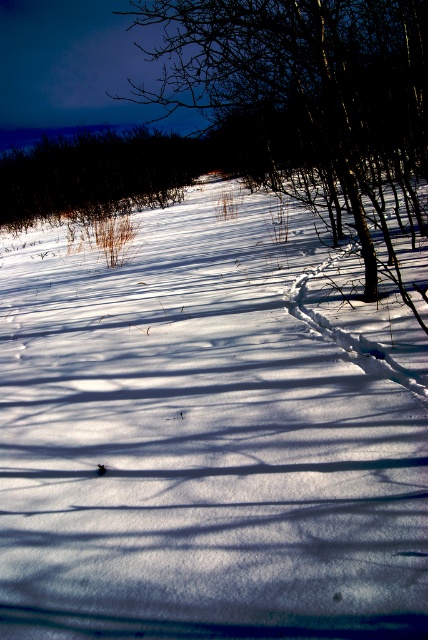
You are an observer looking at the winter scene. You notice the white snow at center and the dark brown shrub at upper left. Which object is positioned higher in the image?

The dark brown shrub at upper left is positioned higher in the image than the white snow at center.

You are an animal tracker observing the winter landscape. You see the white snow at center and the brown textured tree at center. How far apart are these two landmarks?

The white snow at center is 12.34 feet from the brown textured tree at center.

You are an artist sketching the winter scene. You want to draw the brown textured tree at center and the dark brown shrub at upper left. Which one should you draw first if you follow the rule of starting with larger objects?

The brown textured tree at center is bigger than the dark brown shrub at upper left, so you should draw the brown textured tree at center first.